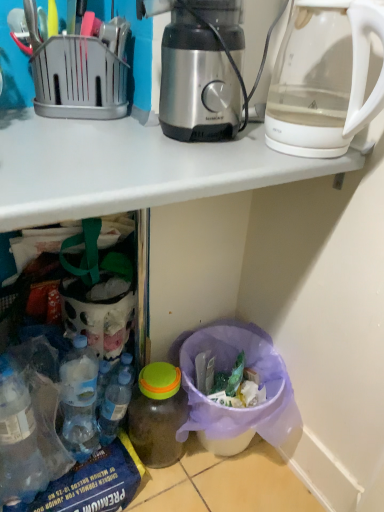
The height and width of the screenshot is (512, 384). In order to click on vacant space situated on the left part of transparent glass kettle at upper right in this screenshot , I will do `click(221, 157)`.